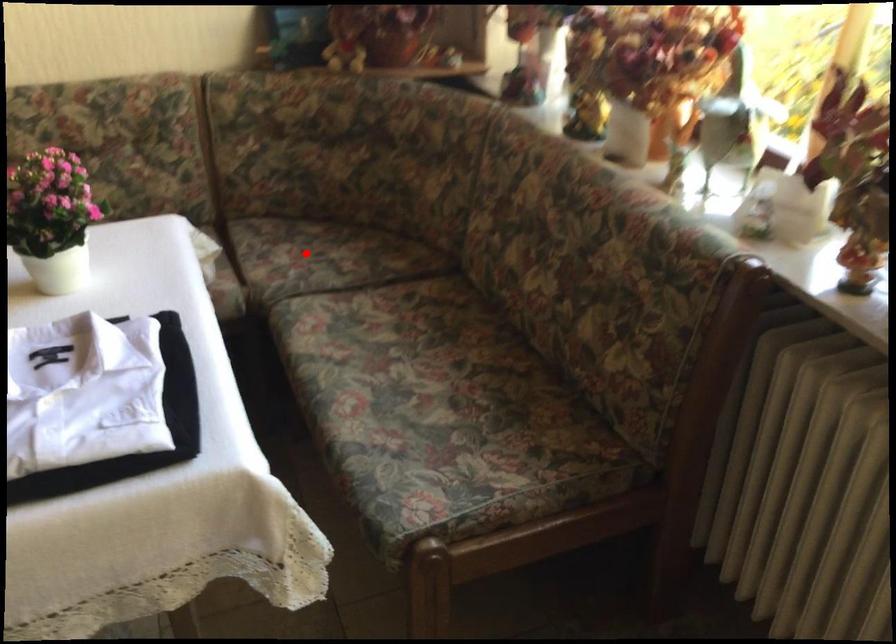
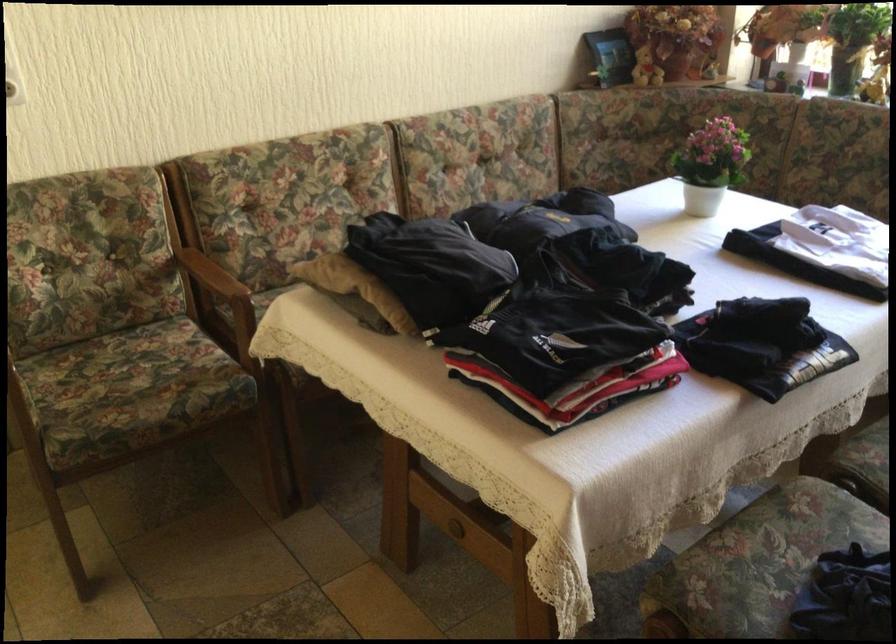
Question: I am providing you with two images of the same scene from different viewpoints. A red point is marked on the first image. Can you still see the location of the red point in image 2?

Choices:
 (A) Yes
 (B) No

Answer: (B)